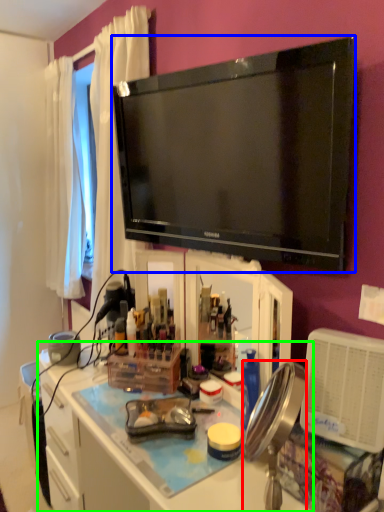
Question: Estimate the real-world distances between objects in this image. Which object is farther from mirror (highlighted by a red box), television (highlighted by a blue box) or desk (highlighted by a green box)?

Choices:
 (A) television
 (B) desk

Answer: (A)